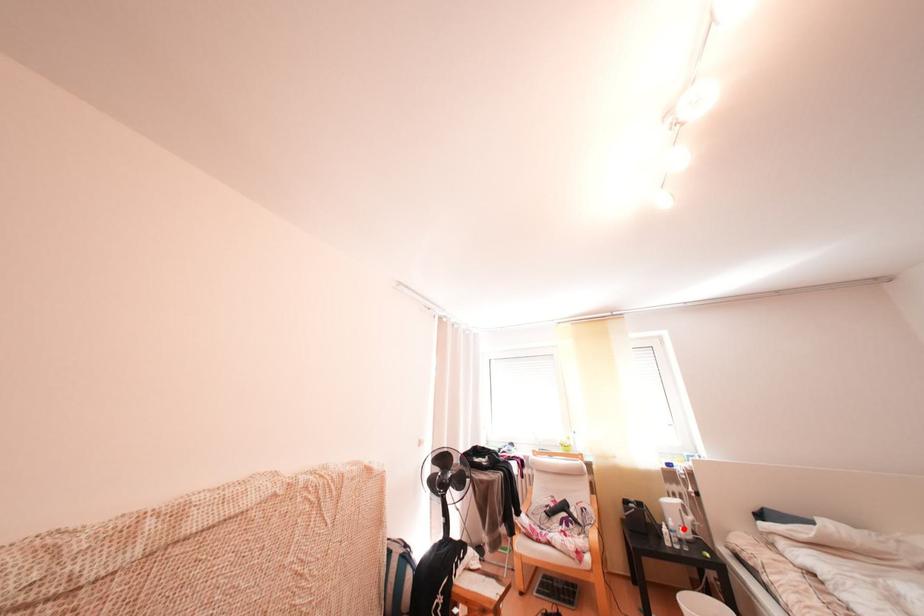
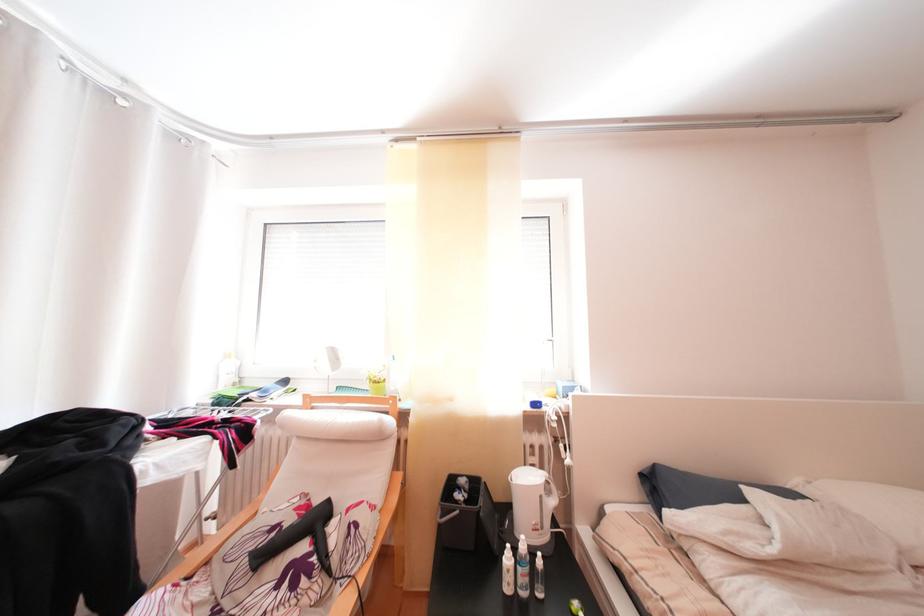
Where in the second image is the point corresponding to the highlighted location from the first image?

(536, 553)